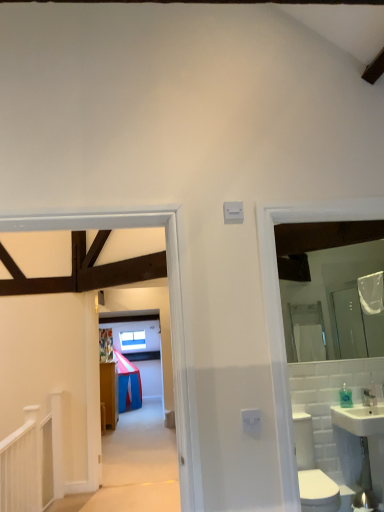
Question: Should I look upward or downward to see white ceramic sink at right?

Choices:
 (A) up
 (B) down

Answer: (B)

Question: Could white ceramic sink at right be considered to be inside white glossy toilet bowl at lower right?

Choices:
 (A) yes
 (B) no

Answer: (B)

Question: From a real-world perspective, is white glossy toilet bowl at lower right on white ceramic sink at right?

Choices:
 (A) yes
 (B) no

Answer: (B)

Question: Is white glossy toilet bowl at lower right positioned far away from white ceramic sink at right?

Choices:
 (A) no
 (B) yes

Answer: (A)

Question: From the image's perspective, would you say white glossy toilet bowl at lower right is positioned over white ceramic sink at right?

Choices:
 (A) no
 (B) yes

Answer: (A)

Question: From a real-world perspective, is white glossy toilet bowl at lower right positioned under white ceramic sink at right based on gravity?

Choices:
 (A) no
 (B) yes

Answer: (B)

Question: Is white glossy toilet bowl at lower right completely or partially outside of white ceramic sink at right?

Choices:
 (A) yes
 (B) no

Answer: (A)

Question: Is clear glass mirror at right not within white ceramic sink at right?

Choices:
 (A) no
 (B) yes

Answer: (B)

Question: Is clear glass mirror at right facing towards white ceramic sink at right?

Choices:
 (A) yes
 (B) no

Answer: (B)

Question: Can you confirm if clear glass mirror at right is wider than white ceramic sink at right?

Choices:
 (A) yes
 (B) no

Answer: (B)

Question: Is clear glass mirror at right touching white ceramic sink at right?

Choices:
 (A) no
 (B) yes

Answer: (A)

Question: Are clear glass mirror at right and white ceramic sink at right far apart?

Choices:
 (A) no
 (B) yes

Answer: (B)

Question: Does clear glass mirror at right have a larger size compared to white ceramic sink at right?

Choices:
 (A) yes
 (B) no

Answer: (B)

Question: Are clear plastic bottle at right and wooden floorboards at center far apart?

Choices:
 (A) no
 (B) yes

Answer: (B)